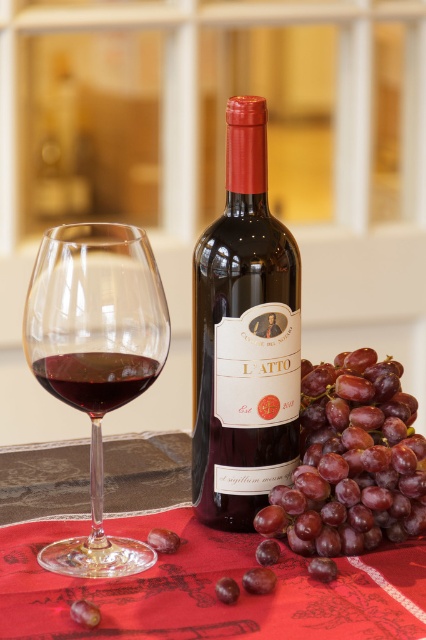
From the picture: Is matte glass bottle at center above transparent glass at left?

Indeed, matte glass bottle at center is positioned over transparent glass at left.

Can you confirm if matte glass bottle at center is shorter than transparent glass at left?

No.

Does point (224, 476) come closer to viewer compared to point (143, 356)?

No, (224, 476) is further to viewer.

What are the coordinates of `matte glass bottle at center` in the screenshot? It's located at (242, 337).

Which is in front, point (247, 435) or point (92, 394)?

Positioned in front is point (92, 394).

Is point (276, 403) behind point (129, 378)?

Yes, it is.

Find the location of `matte glass bottle at center`. matte glass bottle at center is located at coordinates (242, 337).

Which is more to the left, shiny purple grapes at center-right or red glass at center?

From the viewer's perspective, red glass at center appears more on the left side.

Which is above, shiny purple grapes at center-right or red glass at center?

Positioned higher is red glass at center.

Where is `shiny purple grapes at center-right`? The height and width of the screenshot is (640, 426). shiny purple grapes at center-right is located at coordinates (351, 461).

Locate an element on the screen. The height and width of the screenshot is (640, 426). shiny purple grapes at center-right is located at coordinates point(351,461).